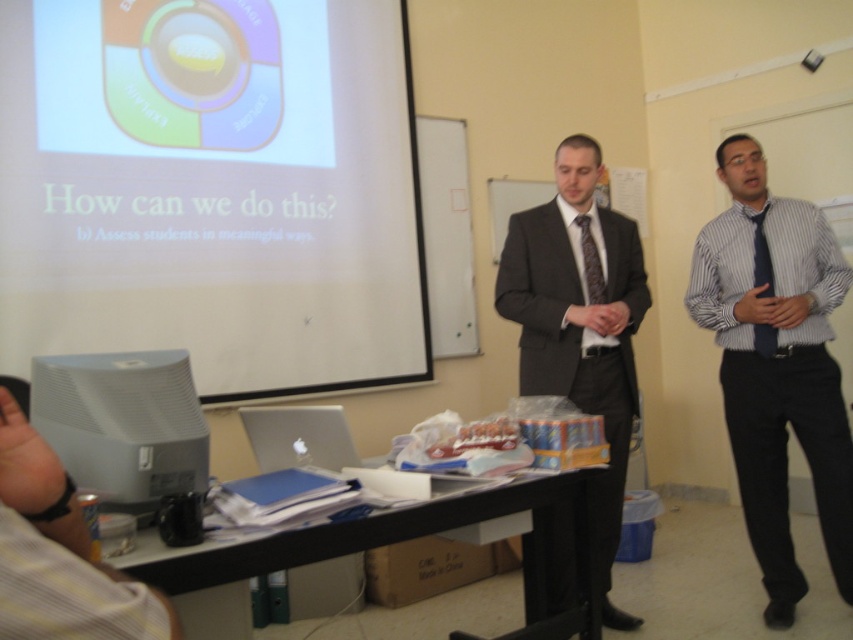
Is white plastic computer at lower left below dark brown textured tie at center?

Indeed, white plastic computer at lower left is positioned under dark brown textured tie at center.

This screenshot has width=853, height=640. I want to click on white plastic computer at lower left, so click(123, 422).

Is point (807, 429) positioned after point (599, 282)?

No.

Between point (820, 488) and point (585, 262), which one is positioned behind?

The point (585, 262) is more distant.

The width and height of the screenshot is (853, 640). What do you see at coordinates (776, 364) in the screenshot? I see `blue striped shirt at right` at bounding box center [776, 364].

At what (x,y) coordinates should I click in order to perform the action: click on blue striped shirt at right. Please return your answer as a coordinate pair (x, y). Looking at the image, I should click on (776, 364).

Can you confirm if white matte projection screen at upper left is positioned to the left of white plastic computer at lower left?

Indeed, white matte projection screen at upper left is positioned on the left side of white plastic computer at lower left.

In the scene shown: Who is taller, white matte projection screen at upper left or white plastic computer at lower left?

With more height is white matte projection screen at upper left.

Is point (178, 236) positioned behind point (136, 483)?

Yes, it is.

Identify the location of white matte projection screen at upper left. The width and height of the screenshot is (853, 640). (213, 189).